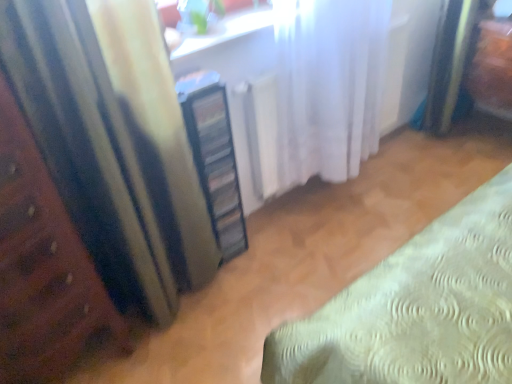
Question: From a real-world perspective, is matte yellow curtain at left, the second curtain viewed from the right, positioned over white sheer curtain at center, positioned as the 1th curtain in right-to-left order, based on gravity?

Choices:
 (A) yes
 (B) no

Answer: (A)

Question: Does matte yellow curtain at left, the 1th curtain from the left, have a greater height compared to white sheer curtain at center, positioned as the 1th curtain in right-to-left order?

Choices:
 (A) no
 (B) yes

Answer: (B)

Question: Does matte yellow curtain at left, the second curtain viewed from the right, appear on the left side of white sheer curtain at center, the second curtain from the left?

Choices:
 (A) no
 (B) yes

Answer: (B)

Question: Is matte yellow curtain at left, the 1th curtain from the left, further to camera compared to white sheer curtain at center, the second curtain from the left?

Choices:
 (A) yes
 (B) no

Answer: (B)

Question: Does matte yellow curtain at left, the 1th curtain from the left, touch white sheer curtain at center, the second curtain from the left?

Choices:
 (A) no
 (B) yes

Answer: (A)

Question: Can you confirm if matte yellow curtain at left, the second curtain viewed from the right, is wider than white sheer curtain at center, the second curtain from the left?

Choices:
 (A) yes
 (B) no

Answer: (B)

Question: Does matte yellow curtain at left, the second curtain viewed from the right, have a lesser width compared to wooden bed frame at left?

Choices:
 (A) no
 (B) yes

Answer: (B)

Question: Is matte yellow curtain at left, the second curtain viewed from the right, next to wooden bed frame at left?

Choices:
 (A) yes
 (B) no

Answer: (B)

Question: Is matte yellow curtain at left, the 1th curtain from the left, far from wooden bed frame at left?

Choices:
 (A) yes
 (B) no

Answer: (B)

Question: Considering the relative sizes of matte yellow curtain at left, the 1th curtain from the left, and wooden bed frame at left in the image provided, is matte yellow curtain at left, the 1th curtain from the left, taller than wooden bed frame at left?

Choices:
 (A) no
 (B) yes

Answer: (B)

Question: Is the depth of matte yellow curtain at left, the second curtain viewed from the right, less than that of wooden bed frame at left?

Choices:
 (A) yes
 (B) no

Answer: (B)

Question: Is matte yellow curtain at left, the second curtain viewed from the right, smaller than wooden bed frame at left?

Choices:
 (A) no
 (B) yes

Answer: (B)

Question: Considering the relative sizes of matte yellow curtain at left, the 1th curtain from the left, and white glossy window sill at upper center in the image provided, is matte yellow curtain at left, the 1th curtain from the left, wider than white glossy window sill at upper center?

Choices:
 (A) yes
 (B) no

Answer: (A)